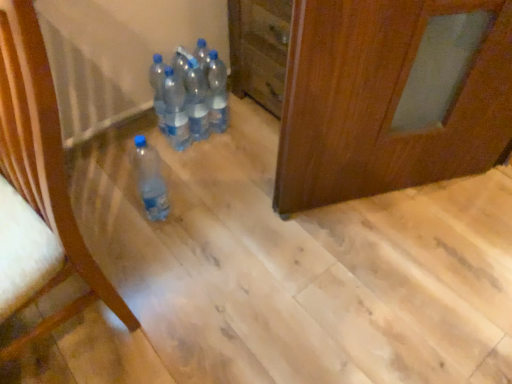
The width and height of the screenshot is (512, 384). I want to click on free location to the right of transparent plastic bottles at center, the third bottle positioned from the left, so pos(222,150).